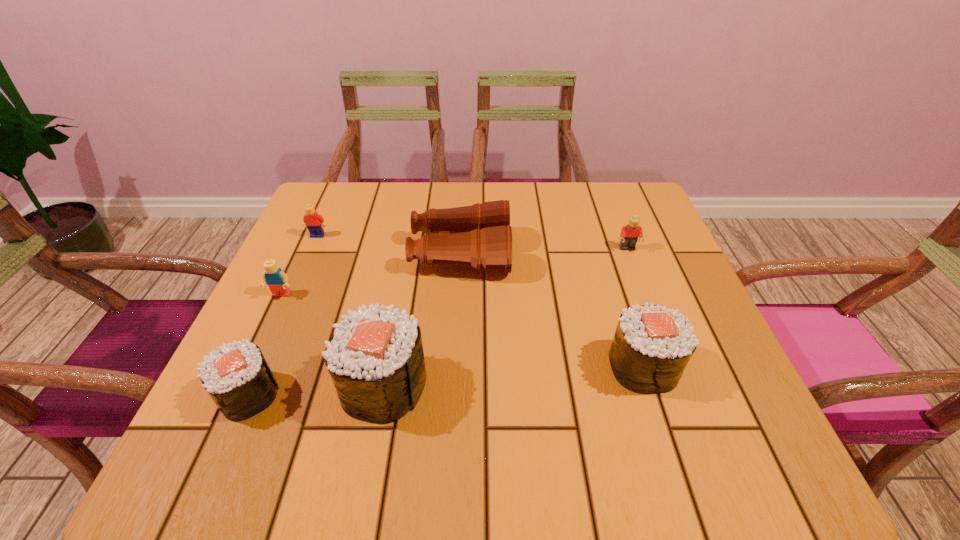
Please point a space for a new sushi to maintain equal intervals. Please provide its 2D coordinates. Your answer should be formatted as a tuple, i.e. [(x, y)], where the tuple contains the x and y coordinates of a point satisfying the conditions above.

[(516, 376)]